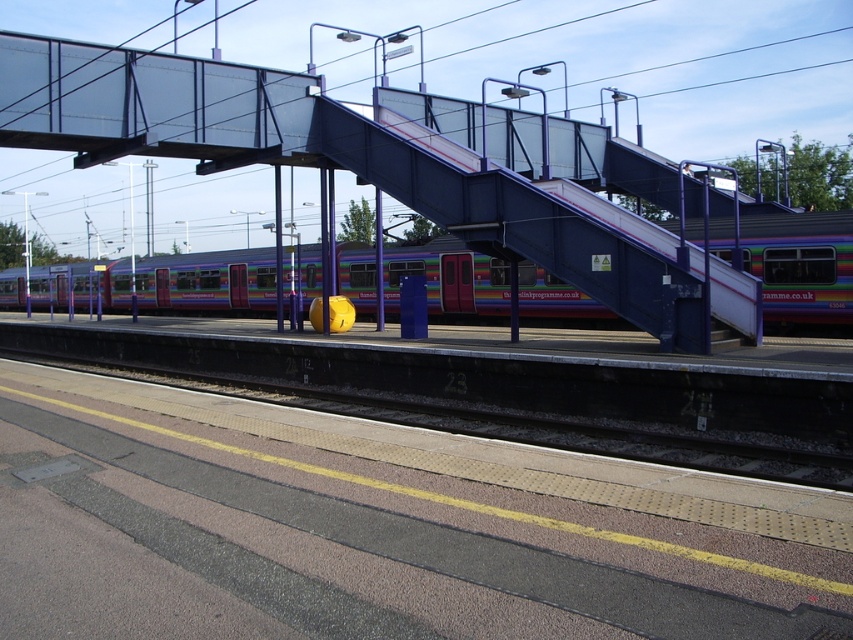
You are a maintenance worker needing to reach the top of the metallic blue escalator at center and the metallic purple train at center. Which object will require a taller ladder?

The metallic blue escalator at center is much taller than the metallic purple train at center, so you will need a taller ladder to reach the top of the metallic blue escalator at center.

You are a maintenance worker needing to move a large equipment cart that is 2 meters wide. You are on the platform and see the metallic blue escalator at center and the metallic purple train at center. Which object can accommodate the width of your cart?

The metallic purple train at center has a greater width than the metallic blue escalator at center, so the cart can fit through the metallic purple train at center.

You are standing on the platform and want to board the metallic purple train at center. There is a metallic blue escalator at center nearby. Which direction should you go relative to the train to reach the escalator?

The metallic blue escalator at center is positioned on the right side of the metallic purple train at center. To reach the escalator, you should move toward the right side of the metallic purple train at center.